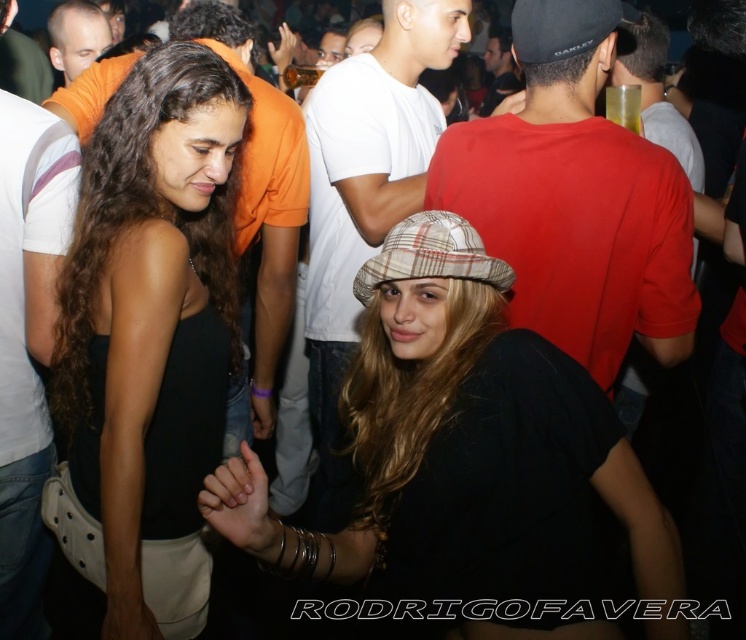
What is the color of the clothing worn by the person located at coordinates point (150, 310)?

The color of the clothing worn by the person located at coordinates point (150, 310) is matte black.

Based on the photo, you are at a party and want to introduce yourself to both women wearing the matte black tank top at center and the matte red shirt at center. Which one should you approach first if you want to greet the person closer to the entrance?

The matte black tank top at center is to the left of matte red shirt at center. Since the entrance is typically on the left side, you should approach the matte black tank top at center first.